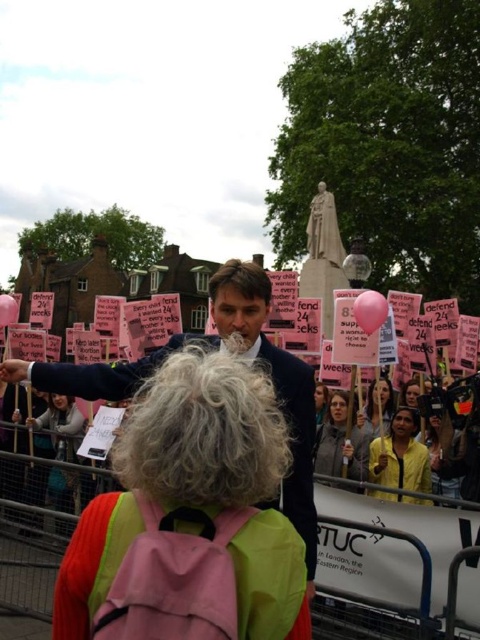
Question: Based on their relative distances, which object is nearer to the smooth yellow jacket at center?

Choices:
 (A) light brown hair at center
 (B) smooth black hair at center
 (C) smooth pink balloon at center

Answer: (C)

Question: Which point is farther from the camera taking this photo?

Choices:
 (A) (403, 497)
 (B) (336, 460)

Answer: (B)

Question: Can you confirm if dark blue suit at center is wider than matte gray hoodie at center?

Choices:
 (A) yes
 (B) no

Answer: (A)

Question: Can you confirm if dark blue suit at center is wider than matte gray hoodie at center?

Choices:
 (A) no
 (B) yes

Answer: (B)

Question: Which object appears closest to the camera in this image?

Choices:
 (A) light brown hair at center
 (B) smooth black hair at center
 (C) dark blue suit at center

Answer: (C)

Question: Can you confirm if yellow matte jacket at lower center is thinner than smooth yellow jacket at center?

Choices:
 (A) yes
 (B) no

Answer: (B)